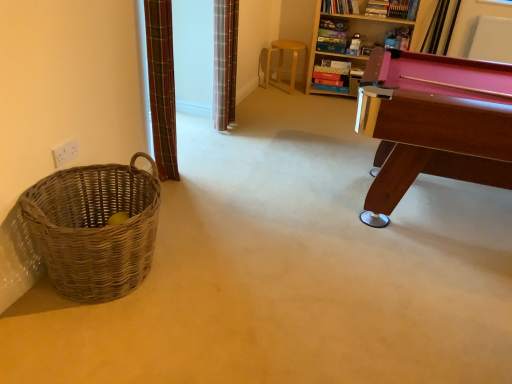
Question: Is point (154, 152) closer or farther from the camera than point (371, 34)?

Choices:
 (A) farther
 (B) closer

Answer: (B)

Question: Is plaid fabric curtain at left, which is the 2th curtain from back to front, taller or shorter than wooden bookcase at upper right?

Choices:
 (A) short
 (B) tall

Answer: (B)

Question: Based on their relative distances, which object is farther from the light brown wooden stool at center?

Choices:
 (A) pink wood pool table at right
 (B) plaid fabric curtain at left, which is the 2th curtain from back to front
 (C) wooden bookcase at upper right
 (D) woven brown basket at left
 (E) plaid fabric curtain at upper center, the first curtain positioned from the back

Answer: (D)

Question: Estimate the real-world distances between objects in this image. Which object is closer to the pink wood pool table at right?

Choices:
 (A) plaid fabric curtain at upper center, the first curtain positioned from the back
 (B) light brown wooden stool at center
 (C) plaid fabric curtain at left, acting as the second curtain starting from the right
 (D) woven brown basket at left
 (E) wooden bookcase at upper right

Answer: (C)